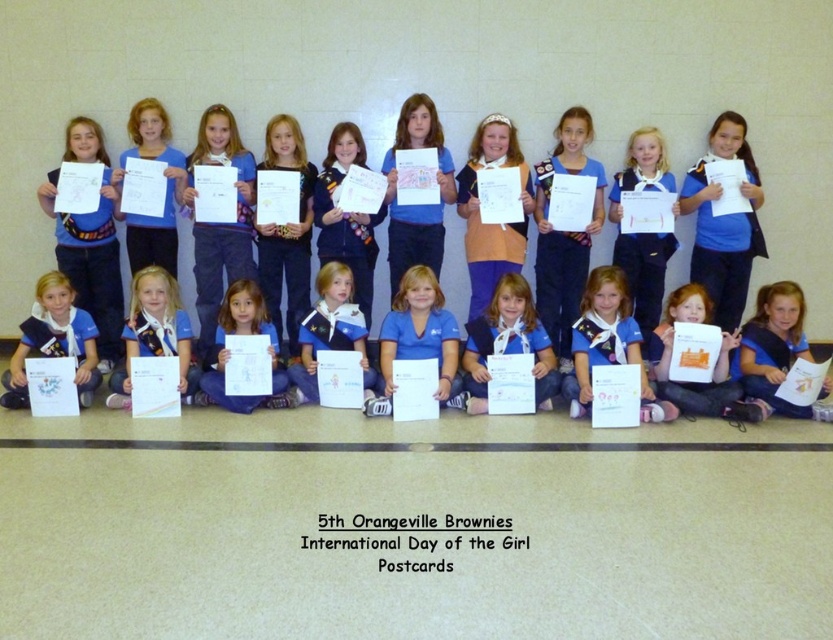
You are standing at the bottom of the image where the dark stripe on the floor is. Looking up towards the center of the image, what object is located at the coordinates point [607,344]?

The blue fabric uniform at center is located at point [607,344].

You are a photographer trying to capture a photo of the group of girls for the event. You notice the blue fabric uniform at center and the matte blue uniform at lower left. Which uniform is positioned to the right of the other?

The blue fabric uniform at center is to the right of the matte blue uniform at lower left.

From the picture: You are a photographer trying to capture a group photo of the girls in their uniforms. You notice the blue fabric uniform at center and the matte blue uniform at lower left. Which uniform should you focus on if you want to highlight the tallest uniform in the group?

The blue fabric uniform at center has a greater height compared to the matte blue uniform at lower left, so you should focus on the blue fabric uniform at center to highlight the tallest uniform in the group.